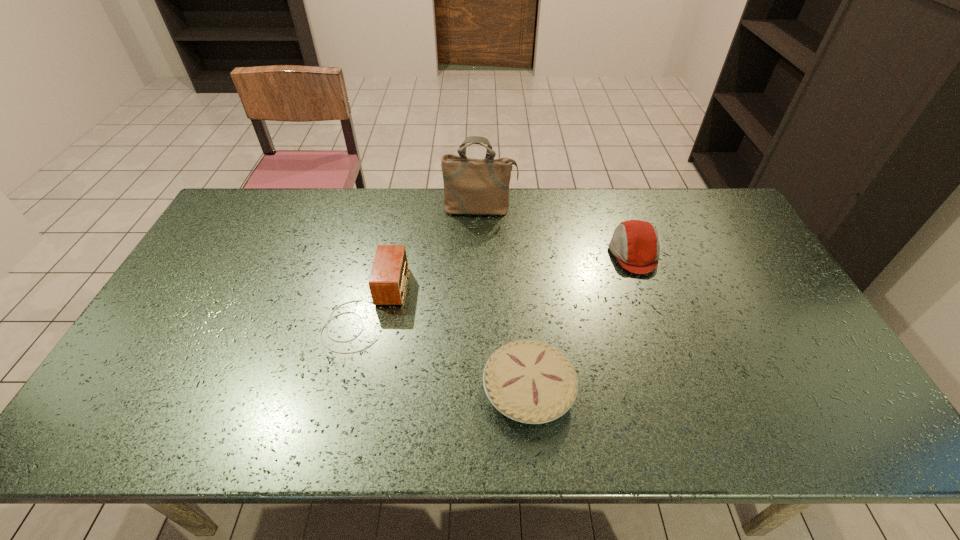
Image resolution: width=960 pixels, height=540 pixels. Identify the location of free space that satisfies the following two spatial constraints: 1. on the front-facing side of the pie; 2. on the right side of the tallest object. (480, 389).

Locate an element on the screen. The height and width of the screenshot is (540, 960). vacant space that satisfies the following two spatial constraints: 1. on the front-facing side of the leftmost object; 2. on the right side of the shortest object is located at coordinates (347, 389).

At what (x,y) coordinates should I click in order to perform the action: click on vacant area in the image that satisfies the following two spatial constraints: 1. on the front-facing side of the pie; 2. on the left side of the farthest object. Please return your answer as a coordinate pair (x, y). Looking at the image, I should click on (480, 389).